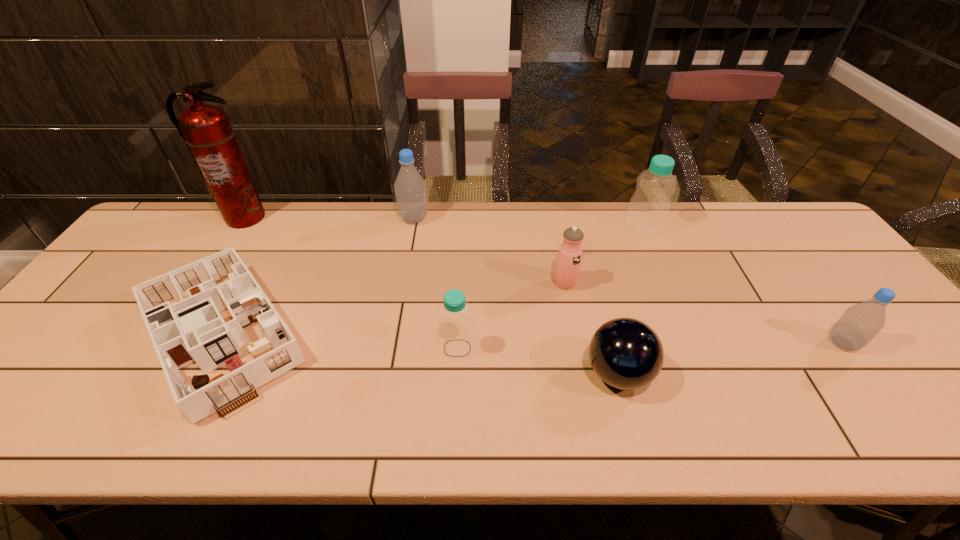
I want to click on the seventh tallest object, so click(625, 353).

Where is `black bowling ball`? black bowling ball is located at coordinates (625, 353).

Locate an element on the screen. The image size is (960, 540). dollhouse is located at coordinates (189, 318).

The image size is (960, 540). What are the coordinates of `vacant point located on the nozzle side of the tallest object` in the screenshot? It's located at (189, 305).

Where is `free space located on the right of the right blue bottle`? The image size is (960, 540). free space located on the right of the right blue bottle is located at coordinates (787, 228).

The image size is (960, 540). I want to click on free space located 0.310m on the left of the bigger gray bottle, so click(x=303, y=219).

Find the location of a particular element. Image resolution: width=960 pixels, height=540 pixels. vacant space situated on the front of the thermos bottle is located at coordinates (570, 312).

Locate an element on the screen. vacant region located on the right of the nearer gray bottle is located at coordinates (895, 343).

Identify the location of blank area located on the back of the third bottle from right to left. The image size is (960, 540). (462, 252).

Where is `vacant space located 0.320m on the side of the seventh tallest object with the finger holes`? vacant space located 0.320m on the side of the seventh tallest object with the finger holes is located at coordinates (444, 374).